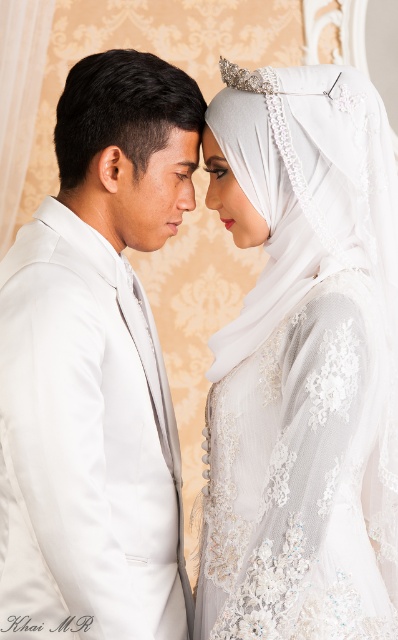
You are a photographer setting up for a wedding photo shoot. You need to position a spotlight exactly at point [95,371]. According to the image, what object will the spotlight illuminate?

The spotlight at point [95,371] will illuminate the matte white suit at left.

You are a photographer who needs to adjust the lighting to ensure the white lace hijab at upper center is well lit. Based on its position at point 0.569, 0.761, where should you place the light source to avoid harsh shadows?

The white lace hijab at upper center is positioned at point (302, 364). To avoid harsh shadows, the light source should be placed directly in front of the hijab, aligned with the camera, ensuring even lighting without creating strong directional shadows.